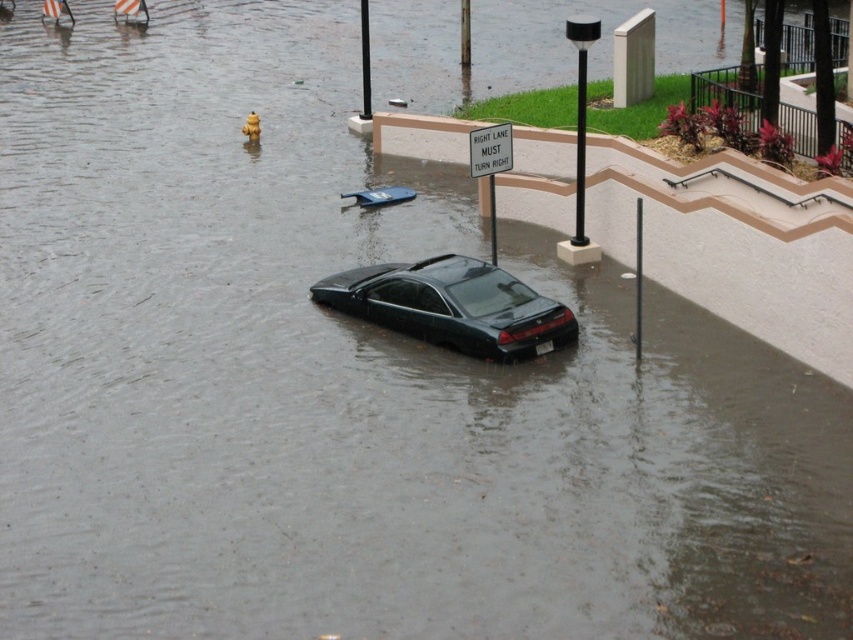
You are driving a car and see the flooded street with the dark sedan submerged in water. There are two points marked on your GPS navigation screen at coordinates point (x=422, y=323) and point (x=509, y=129). Which point is closer to your current position if you are approaching from the direction indicated by the traffic sign that says RIGHT LANE MUST TURN RIGHT?

Point (x=422, y=323) is in front of point (x=509, y=129), so if you are approaching from the direction of the RIGHT LANE MUST TURN RIGHT sign, point (x=422, y=323) would be closer to your current position since it is ahead in your path.

You are a driver trying to navigate through the flooded street. You see the dark gray matte car at center and the white plastic sign at center. Which object is taller?

The dark gray matte car at center is much taller than the white plastic sign at center.

You are driving a car that is 1.8 meters wide. You see the dark gray matte car at center and the white plastic sign at center in the flooded street. Can your car fit between them without touching either?

The dark gray matte car at center and the white plastic sign at center are 1.93 meters apart, so yes, your car can fit between them since the distance is wider than your car.